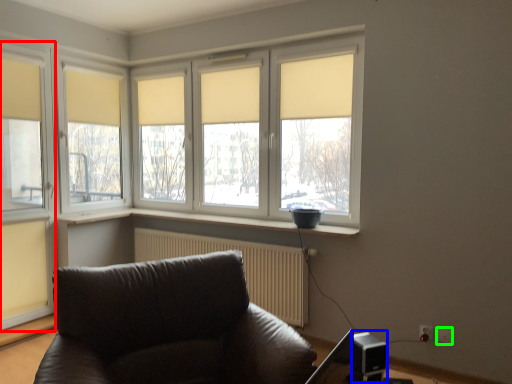
Question: Considering the real-world distances, which object is closest to window (highlighted by a red box)? speaker (highlighted by a blue box) or electric outlet (highlighted by a green box).

Choices:
 (A) speaker
 (B) electric outlet

Answer: (A)